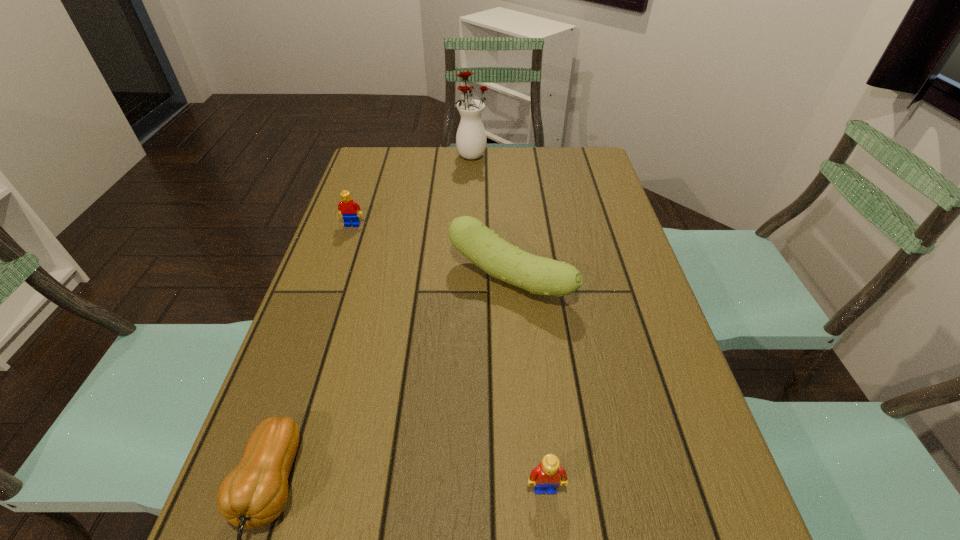
In order to click on object present at the left edge in this screenshot , I will do `click(347, 207)`.

Locate an element on the screen. The image size is (960, 540). vacant space at the far edge of the desktop is located at coordinates (455, 151).

Locate an element on the screen. Image resolution: width=960 pixels, height=540 pixels. vacant space at the left edge is located at coordinates (316, 318).

The width and height of the screenshot is (960, 540). In the image, there is a desktop. In order to click on vacant space at the right edge in this screenshot , I will do `click(607, 271)`.

In the image, there is a desktop. Find the location of `vacant space at the far left corner`. vacant space at the far left corner is located at coordinates [x=372, y=183].

You are a GUI agent. You are given a task and a screenshot of the screen. Output one action in this format:
    pyautogui.click(x=<x>, y=<y>)
    Task: Click on the free spot at the far right corner of the desktop
    Image resolution: width=960 pixels, height=540 pixels.
    Given the screenshot: What is the action you would take?
    pyautogui.click(x=562, y=152)

At what (x,y) coordinates should I click in order to perform the action: click on vacant point located between the third nearest object and the fourth nearest object. Please return your answer as a coordinate pair (x, y). This screenshot has width=960, height=540. Looking at the image, I should click on (431, 252).

In order to click on vacant space in between the nearer Lego and the tallest object in this screenshot , I will do `click(509, 321)`.

Where is `vacant space that's between the farthest object and the third farthest object`? The image size is (960, 540). vacant space that's between the farthest object and the third farthest object is located at coordinates coord(492,217).

Locate an element on the screen. The width and height of the screenshot is (960, 540). empty location between the farthest object and the right Lego is located at coordinates pyautogui.click(x=509, y=321).